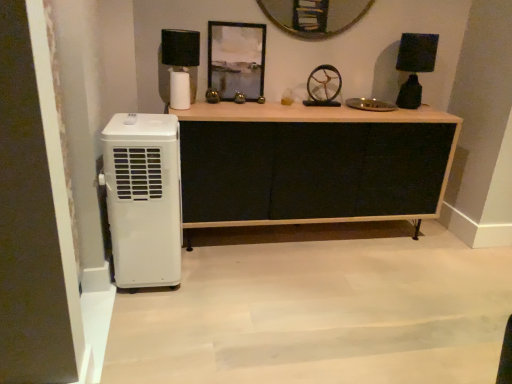
The width and height of the screenshot is (512, 384). What do you see at coordinates (312, 164) in the screenshot?
I see `black fabric cabinet at center` at bounding box center [312, 164].

Where is `black fabric cabinet at center`? black fabric cabinet at center is located at coordinates (312, 164).

How much space does black matte lampshade at upper left, which appears as the second lamp when viewed from the right, occupy horizontally?

It is 8.31 inches.

The image size is (512, 384). Identify the location of metallic gold wheel at center. (323, 86).

Is there a large distance between black fabric cabinet at center and black matte lampshade at upper left, the first lamp in the left-to-right sequence?

They are positioned close to each other.

In terms of height, does black fabric cabinet at center look taller or shorter compared to black matte lampshade at upper left, the first lamp in the left-to-right sequence?

Clearly, black fabric cabinet at center is taller compared to black matte lampshade at upper left, the first lamp in the left-to-right sequence.

Could you tell me if black fabric cabinet at center is facing black matte lampshade at upper left, the first lamp in the left-to-right sequence?

No.

How distant is black fabric cabinet at center from black matte lampshade at upper left, which appears as the second lamp when viewed from the right?

black fabric cabinet at center is 26.62 inches from black matte lampshade at upper left, which appears as the second lamp when viewed from the right.

Looking at this image, is black fabric cabinet at center positioned beyond the bounds of metallic silver frame at upper center?

Yes.

From the image's perspective, relative to metallic silver frame at upper center, is black fabric cabinet at center above or below?

From the image's perspective, black fabric cabinet at center appears below metallic silver frame at upper center.

Between black fabric cabinet at center and metallic silver frame at upper center, which one has larger width?

black fabric cabinet at center is wider.

In the scene shown: Which is in front, black fabric cabinet at center or metallic silver frame at upper center?

Positioned in front is black fabric cabinet at center.

Are white plastic air conditioner at left and black fabric cabinet at center located far from each other?

That's not correct — white plastic air conditioner at left is a little close to black fabric cabinet at center.

Which of these two, white plastic air conditioner at left or black fabric cabinet at center, stands shorter?

black fabric cabinet at center is shorter.

Is white plastic air conditioner at left thinner than black fabric cabinet at center?

Yes.

From a real-world perspective, does white plastic air conditioner at left stand above black fabric cabinet at center?

Correct, in the physical world, white plastic air conditioner at left is higher than black fabric cabinet at center.

Is black matte lamp at right, arranged as the 1th lamp when viewed from the right, touching white plastic air conditioner at left?

No, black matte lamp at right, arranged as the 1th lamp when viewed from the right, is not next to white plastic air conditioner at left.

How many degrees apart are the facing directions of black matte lamp at right, arranged as the 1th lamp when viewed from the right, and white plastic air conditioner at left?

86.5 degrees separate the facing orientations of black matte lamp at right, arranged as the 1th lamp when viewed from the right, and white plastic air conditioner at left.

From a real-world perspective, who is located higher, black matte lamp at right, the second lamp when ordered from left to right, or white plastic air conditioner at left?

In real-world perspective, black matte lamp at right, the second lamp when ordered from left to right, is above.

Is black matte lamp at right, arranged as the 1th lamp when viewed from the right, inside the boundaries of white plastic air conditioner at left, or outside?

black matte lamp at right, arranged as the 1th lamp when viewed from the right, is not inside white plastic air conditioner at left, it's outside.

Is metallic silver frame at upper center in contact with white plastic air conditioner at left?

They are not placed beside each other.

Between metallic silver frame at upper center and white plastic air conditioner at left, which one has more height?

Standing taller between the two is white plastic air conditioner at left.

Between metallic silver frame at upper center and white plastic air conditioner at left, which one appears on the right side from the viewer's perspective?

metallic silver frame at upper center is more to the right.

Who is more distant, black matte lampshade at upper left, which appears as the second lamp when viewed from the right, or metallic gold wheel at center?

metallic gold wheel at center is more distant.

Does black matte lampshade at upper left, the first lamp in the left-to-right sequence, contain metallic gold wheel at center?

No, metallic gold wheel at center is not a part of black matte lampshade at upper left, the first lamp in the left-to-right sequence.

Is black matte lampshade at upper left, the first lamp in the left-to-right sequence, placed right next to metallic gold wheel at center?

No, black matte lampshade at upper left, the first lamp in the left-to-right sequence, is not touching metallic gold wheel at center.

From the image's perspective, which is above, black matte lampshade at upper left, which appears as the second lamp when viewed from the right, or metallic gold wheel at center?

black matte lampshade at upper left, which appears as the second lamp when viewed from the right, appears higher in the image.

Is white plastic air conditioner at left to the right of metallic silver frame at upper center from the viewer's perspective?

No, white plastic air conditioner at left is not to the right of metallic silver frame at upper center.

Considering the points (143, 115) and (217, 30), which point is behind, point (143, 115) or point (217, 30)?

The point (217, 30) is farther from the camera.

In terms of height, does white plastic air conditioner at left look taller or shorter compared to metallic silver frame at upper center?

In the image, white plastic air conditioner at left appears to be taller than metallic silver frame at upper center.

From the image's perspective, which one is positioned lower, white plastic air conditioner at left or metallic silver frame at upper center?

white plastic air conditioner at left is shown below in the image.

Find the location of a particular element. chest of drawers in front of the black matte lampshade at upper left, the first lamp in the left-to-right sequence is located at coordinates (312, 164).

You are a GUI agent. You are given a task and a screenshot of the screen. Output one action in this format:
    pyautogui.click(x=<x>, y=<y>)
    Task: Click on the picture frame behind the black fabric cabinet at center
    The height and width of the screenshot is (384, 512).
    Given the screenshot: What is the action you would take?
    pyautogui.click(x=236, y=59)

Based on their spatial positions, is metallic silver frame at upper center or white plastic air conditioner at left further from metallic gold wheel at center?

white plastic air conditioner at left lies further to metallic gold wheel at center than the other object.

Considering their positions, is black fabric cabinet at center positioned closer to black matte lampshade at upper left, the first lamp in the left-to-right sequence, than black matte lamp at right, arranged as the 1th lamp when viewed from the right?

Among the two, black fabric cabinet at center is located nearer to black matte lampshade at upper left, the first lamp in the left-to-right sequence.

Considering their positions, is black matte lamp at right, the second lamp when ordered from left to right, positioned closer to metallic silver frame at upper center than white plastic air conditioner at left?

white plastic air conditioner at left lies closer to metallic silver frame at upper center than the other object.

Looking at the image, which one is located closer to white plastic air conditioner at left, black matte lamp at right, arranged as the 1th lamp when viewed from the right, or metallic gold wheel at center?

metallic gold wheel at center is closer to white plastic air conditioner at left.

Looking at this image, which object lies nearer to the anchor point white plastic air conditioner at left, metallic gold wheel at center or black matte lamp at right, the second lamp when ordered from left to right?

Based on the image, metallic gold wheel at center appears to be nearer to white plastic air conditioner at left.

From the image, which object appears to be farther from black fabric cabinet at center, metallic gold wheel at center or black matte lampshade at upper left, the first lamp in the left-to-right sequence?

Among the two, black matte lampshade at upper left, the first lamp in the left-to-right sequence, is located further to black fabric cabinet at center.

Which object lies further to the anchor point metallic silver frame at upper center, black fabric cabinet at center or metallic gold wheel at center?

Among the two, black fabric cabinet at center is located further to metallic silver frame at upper center.

Looking at the image, which one is located further to black fabric cabinet at center, metallic gold wheel at center or white plastic air conditioner at left?

Based on the image, white plastic air conditioner at left appears to be further to black fabric cabinet at center.

This screenshot has height=384, width=512. Find the location of `lamp located between white plastic air conditioner at left and black matte lamp at right, arranged as the 1th lamp when viewed from the right, in the left-right direction`. lamp located between white plastic air conditioner at left and black matte lamp at right, arranged as the 1th lamp when viewed from the right, in the left-right direction is located at coordinates (180, 63).

In order to click on chest of drawers between white plastic air conditioner at left and black matte lamp at right, arranged as the 1th lamp when viewed from the right in this screenshot , I will do `click(312, 164)`.

This screenshot has height=384, width=512. I want to click on lamp situated between white plastic air conditioner at left and metallic gold wheel at center from left to right, so click(180, 63).

Find the location of a particular element. chest of drawers between black matte lampshade at upper left, which appears as the second lamp when viewed from the right, and black matte lamp at right, the second lamp when ordered from left to right, in the horizontal direction is located at coordinates (312, 164).